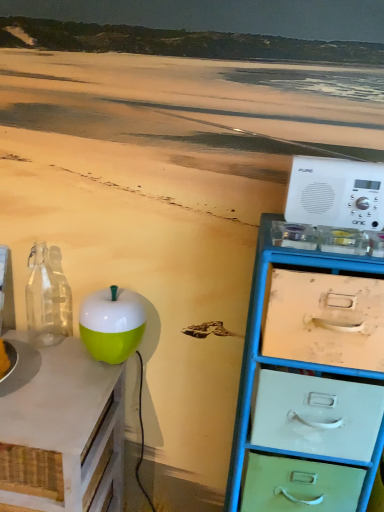
Question: Is transparent glass bottle at left bigger or smaller than metallic blue chest of drawers at right?

Choices:
 (A) small
 (B) big

Answer: (A)

Question: Considering their positions, is transparent glass bottle at left located in front of or behind metallic blue chest of drawers at right?

Choices:
 (A) behind
 (B) front

Answer: (A)

Question: Which is farther from the green glossy apple at center-left?

Choices:
 (A) white plastic radio at right
 (B) green matte apple at left
 (C) transparent glass bottle at left
 (D) metallic blue chest of drawers at right

Answer: (A)

Question: Estimate the real-world distances between objects in this image. Which object is farther from the green matte apple at left?

Choices:
 (A) transparent glass bottle at left
 (B) metallic blue chest of drawers at right
 (C) green glossy apple at center-left
 (D) white plastic radio at right

Answer: (D)